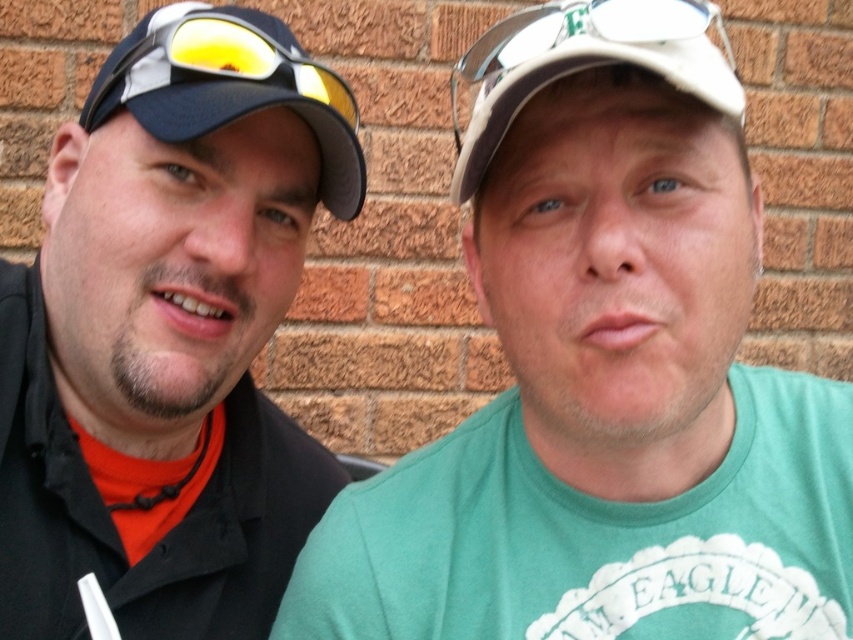
You are a photographer trying to capture both the black matte cap at left and the matte black cap at left in a single frame. Which cap should you focus on first to ensure it appears larger in the photo?

The black matte cap at left is larger in size than the matte black cap at left, so you should focus on the black matte cap at left first to ensure it appears larger in the photo.